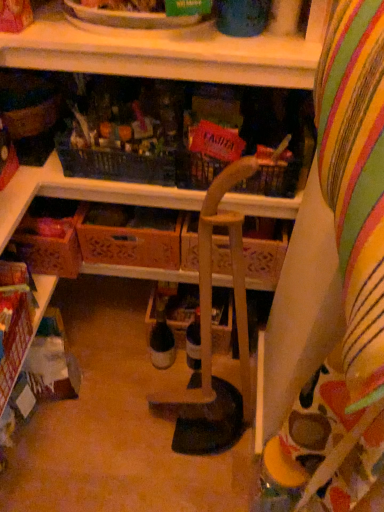
Where is `free location in front of translucent glass bottle at center`? free location in front of translucent glass bottle at center is located at coordinates (152, 410).